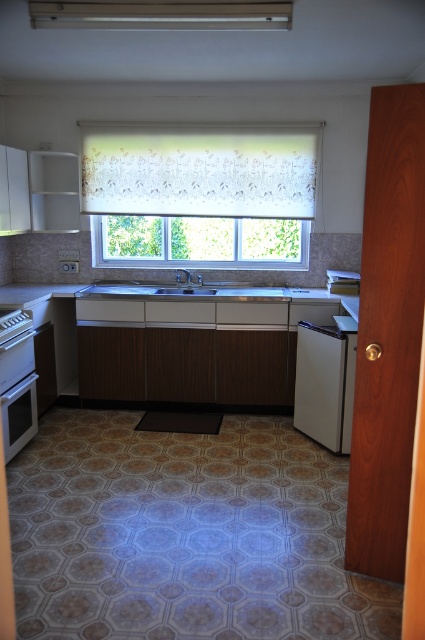
Question: Which object is the farthest from the white glossy counter top at center?

Choices:
 (A) matte silver oven at left
 (B) matte white exhaust hood at upper center

Answer: (B)

Question: Which object is the farthest from the matte silver oven at left?

Choices:
 (A) white floral roller shade at center
 (B) satin white dishwasher at right

Answer: (B)

Question: Observing the image, what is the correct spatial positioning of white glossy counter top at center in reference to matte silver oven at left?

Choices:
 (A) below
 (B) above

Answer: (B)

Question: Can you confirm if white floral roller shade at center is wider than satin white dishwasher at right?

Choices:
 (A) yes
 (B) no

Answer: (A)

Question: Does matte white exhaust hood at upper center have a greater width compared to satin silver sink at center?

Choices:
 (A) yes
 (B) no

Answer: (A)

Question: Which point is farther to the camera?

Choices:
 (A) coord(10,413)
 (B) coord(212,312)
 (C) coord(320,429)
 (D) coord(201,141)

Answer: (D)